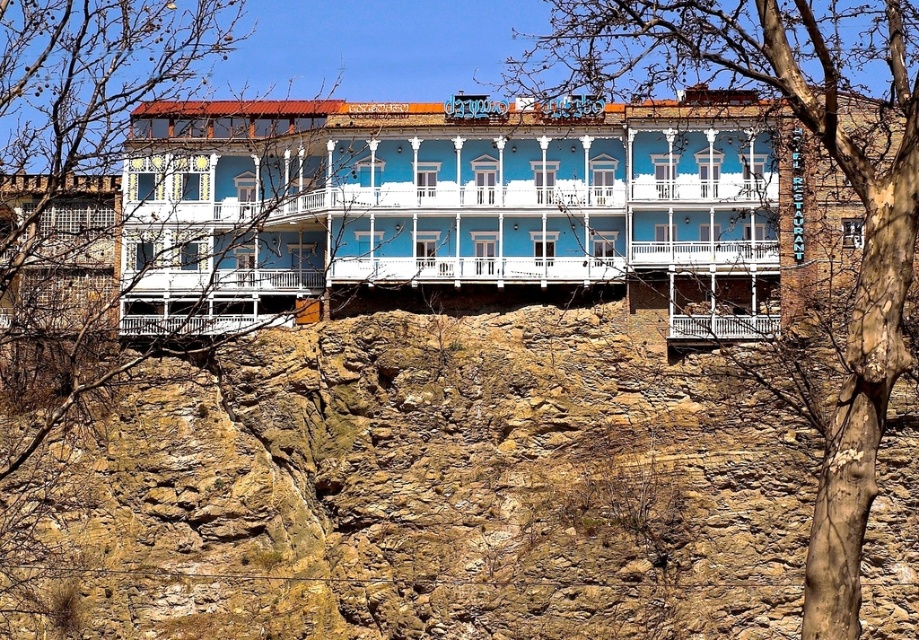
You are a drone operator tasked with capturing aerial footage of the brown rocky hillside at center and the bare branches at upper left. Your drone has a maximum flight range of 40 feet. Can you fly the drone from the hillside to the branches without exceeding its range?

The distance between the brown rocky hillside at center and the bare branches at upper left is 39.03 feet, which is within the drone operator s 40 feet maximum flight range. Yes, the drone can fly from the brown rocky hillside at center to the bare branches at upper left without exceeding its range.

You are standing in front of the vibrant blue building on the cliff. There are two points marked on the structure. One is at coordinate point (702, 605) and the other at point (672, 17). Which point is nearer to your current position?

Point (702, 605) is closer to the camera than point (672, 17), so the point at (702, 605) is nearer to your current position.